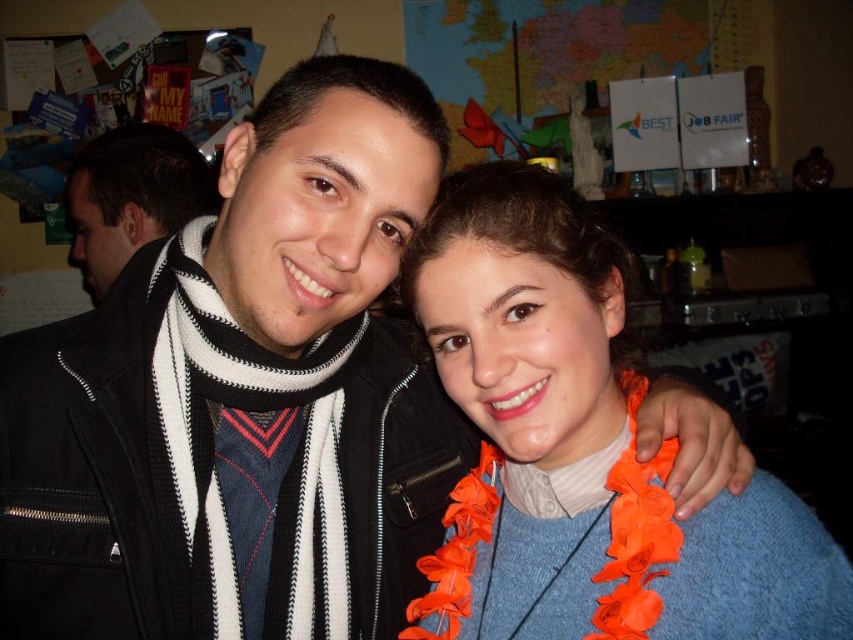
Is point (672, 560) closer to camera compared to point (114, 250)?

That is True.

How distant is orange fabric lei at center from black and white scarf at left?

orange fabric lei at center and black and white scarf at left are 5.46 feet apart from each other.

The height and width of the screenshot is (640, 853). What do you see at coordinates (582, 451) in the screenshot? I see `orange fabric lei at center` at bounding box center [582, 451].

Locate an element on the screen. orange fabric lei at center is located at coordinates (582, 451).